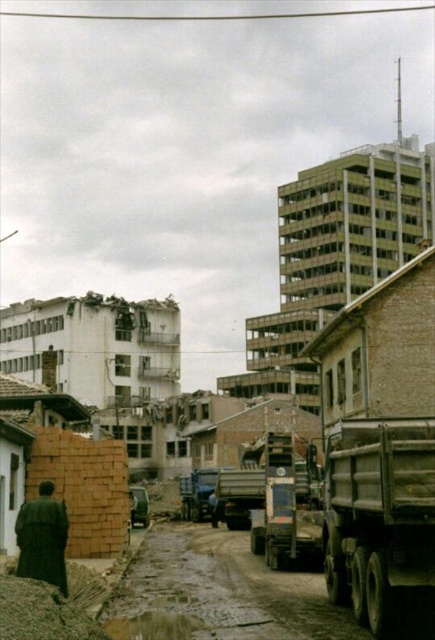
You are a construction worker who needs to move a heavy object from the dark matte coat at lower left to the matte blue truck at center. Given that the shortest path between them is 29.15 meters, and you have a dolly that can carry the object but requires a flat path, can you estimate how long it will take you to push the dolly the entire distance if you move at a steady pace of 1.5 meters per second?

The distance between the dark matte coat at lower left and the matte blue truck at center is 29.15 meters. Moving at 1.5 meters per second, it would take approximately 19.43 seconds to cover the distance. Since the path is flat, the time calculation is straightforward.

You are a construction worker who just arrived at the site and see the brown clay mud at lower left and the dark matte coat at lower left. Which object is closer to the ground?

The brown clay mud at lower left is closer to the ground because it is below the dark matte coat at lower left.

You are a delivery driver who needs to park your vehicle near the construction site. The metallic gray truck at center is blocking the entrance. Can you maneuver your smaller vehicle around it without hitting the brown clay mud at lower left?

The metallic gray truck at center is larger than the brown clay mud at lower left, so you can maneuver around it by going around the smaller mud area since the mud is not as big as the truck.